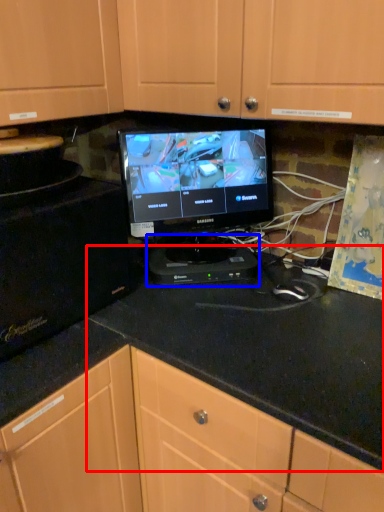
Question: Which of the following is the closest to the observer, counter top (highlighted by a red box) or appliance (highlighted by a blue box)?

Choices:
 (A) counter top
 (B) appliance

Answer: (A)